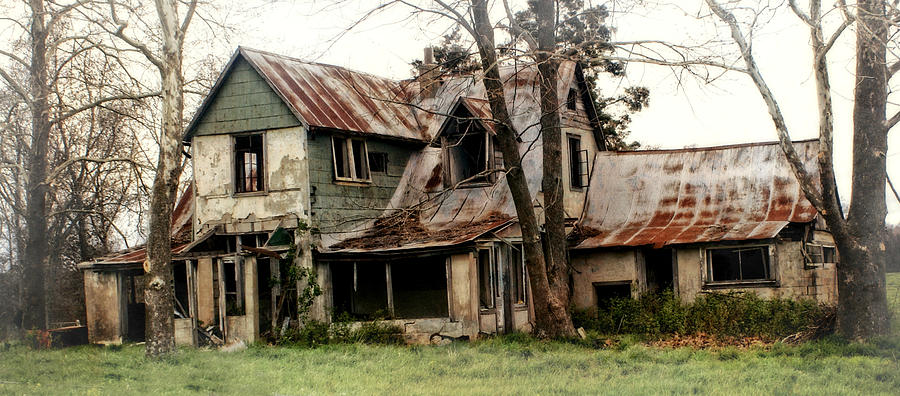
You are a GUI agent. You are given a task and a screenshot of the screen. Output one action in this format:
    pyautogui.click(x=<x>, y=<y>)
    Task: Click on the first floor windows
    The height and width of the screenshot is (396, 900).
    Given the screenshot: What is the action you would take?
    pyautogui.click(x=420, y=290), pyautogui.click(x=374, y=290), pyautogui.click(x=741, y=279)